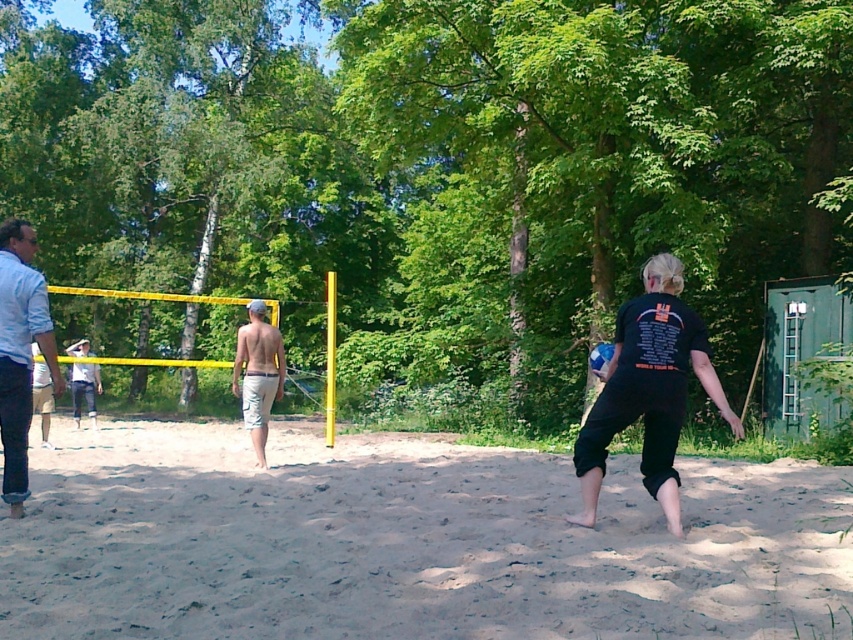
Question: Among these points, which one is nearest to the camera?

Choices:
 (A) (24, 307)
 (B) (102, 392)
 (C) (682, 340)
 (D) (604, 362)

Answer: (C)

Question: Among these objects, which one is nearest to the camera?

Choices:
 (A) blue matte volleyball at center
 (B) light blue denim shirt at left
 (C) fine-grained sand at center

Answer: (C)

Question: Can you confirm if tan shorts at center is positioned to the right of blue matte volleyball at center?

Choices:
 (A) yes
 (B) no

Answer: (B)

Question: Does black matte t-shirt at center have a smaller size compared to tan shorts at center?

Choices:
 (A) yes
 (B) no

Answer: (A)

Question: Is fine-grained sand at center bigger than black matte t-shirt at center?

Choices:
 (A) no
 (B) yes

Answer: (B)

Question: Among these objects, which one is farthest from the camera?

Choices:
 (A) tan shorts at center
 (B) light blue denim shorts at left
 (C) light blue denim shirt at left

Answer: (B)